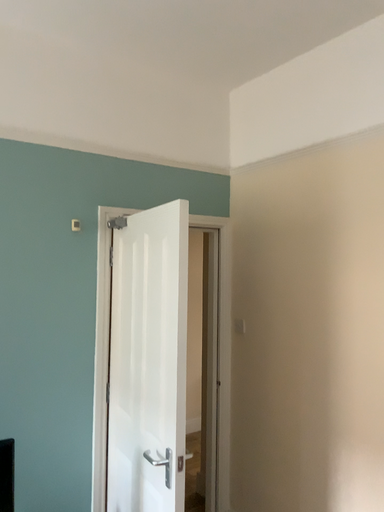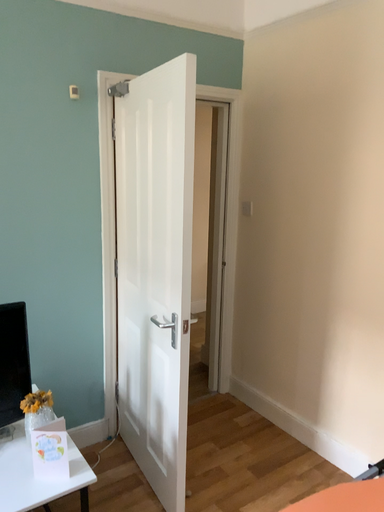
Question: Which way did the camera rotate in the video?

Choices:
 (A) rotated downward
 (B) rotated upward

Answer: (A)